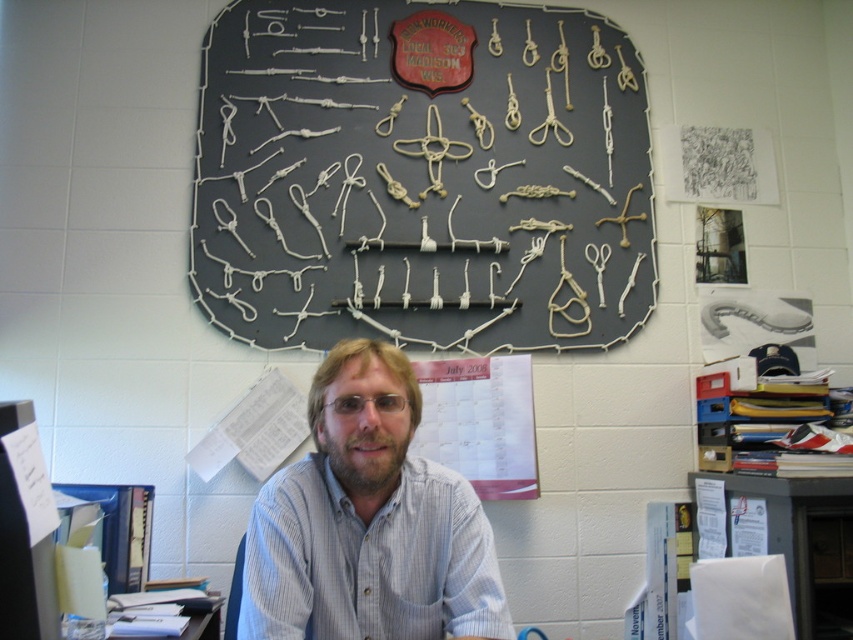
Question: Among these objects, which one is nearest to the camera?

Choices:
 (A) white paper at lower right
 (B) white paper at lower left
 (C) blue striped shirt at center

Answer: (C)

Question: Which point is farther to the camera?

Choices:
 (A) white paper at lower right
 (B) blue striped shirt at center
 (C) white paper at lower left

Answer: (A)

Question: Is black fabric at upper center below blue striped shirt at center?

Choices:
 (A) yes
 (B) no

Answer: (B)

Question: Can you confirm if black fabric at upper center is positioned to the right of white paper at lower left?

Choices:
 (A) yes
 (B) no

Answer: (A)

Question: Is black fabric at upper center in front of white paper at lower right?

Choices:
 (A) no
 (B) yes

Answer: (A)

Question: Which point appears farthest from the camera in this image?

Choices:
 (A) (378, 42)
 (B) (187, 608)
 (C) (390, 394)
 (D) (798, 484)

Answer: (A)